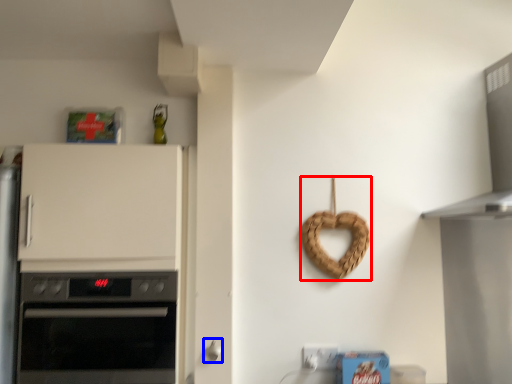
Question: Which of the following is the closest to the observer, appliance (highlighted by a red box) or door handle (highlighted by a blue box)?

Choices:
 (A) appliance
 (B) door handle

Answer: (B)